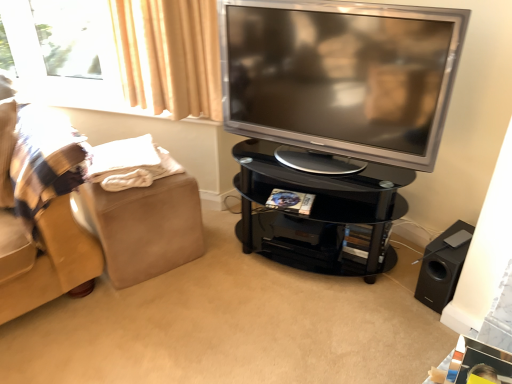
Find the location of a particular element. This screenshot has width=512, height=384. vacant space in front of beige fabric footrest at left is located at coordinates tap(131, 308).